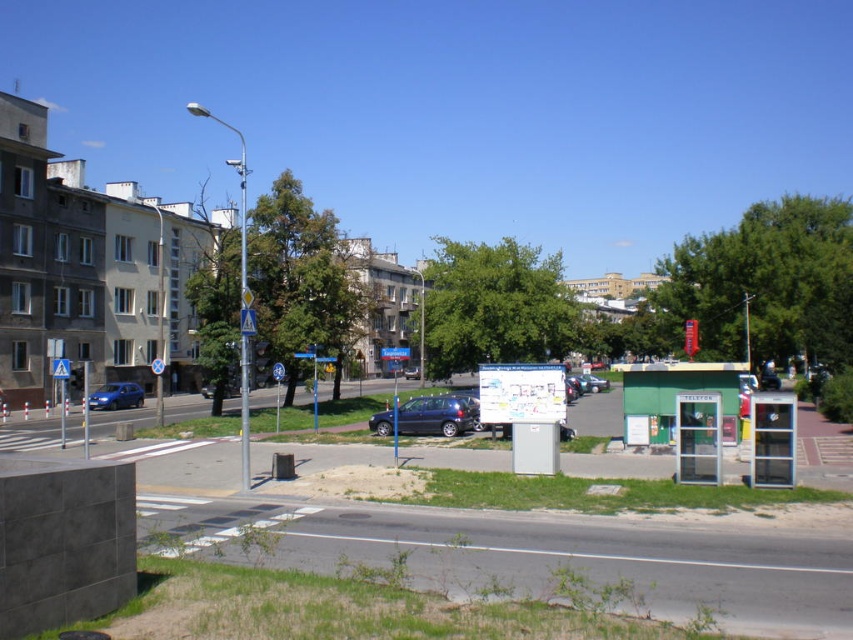
You are standing at the point with coordinates point [427,417]. What object is located at that point?

The point [427,417] corresponds to the metallic blue hatchback at center.

In the scene shown: You are standing at the camera position and want to take a photo of the metallic blue hatchback at center. The camera has a maximum focus range of 25 meters. Will you be able to focus on the hatchback?

The metallic blue hatchback at center and camera are 25.99 meters apart from each other. Since the camera can only focus up to 25 meters, it cannot focus on the hatchback at this distance.